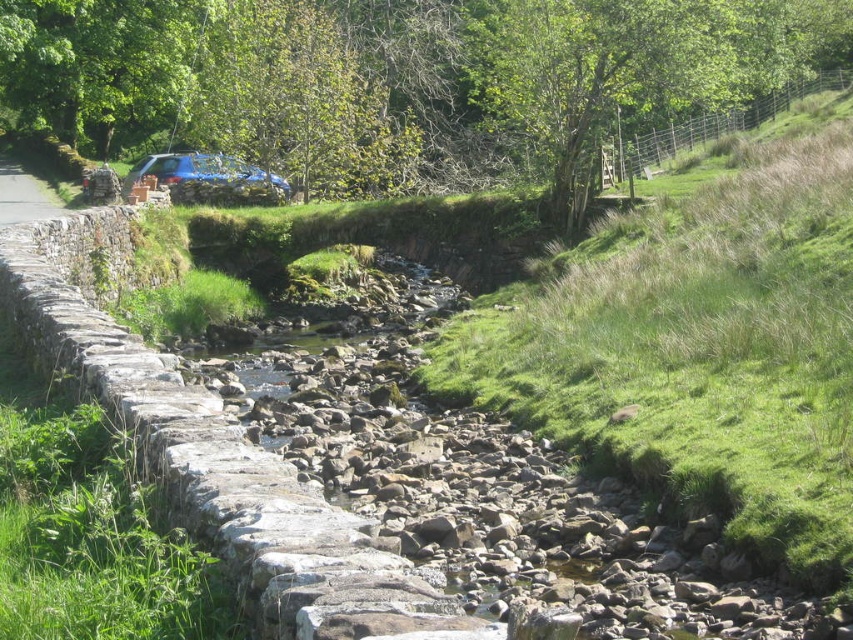
Which is behind, point (218, 177) or point (22, 180)?

The point (22, 180) is behind.

Can you confirm if blue metallic car at center is wider than gray stone path at left?

No, blue metallic car at center is not wider than gray stone path at left.

Which is in front, point (244, 186) or point (65, 209)?

Positioned in front is point (65, 209).

Find the location of a particular element. blue metallic car at center is located at coordinates (204, 172).